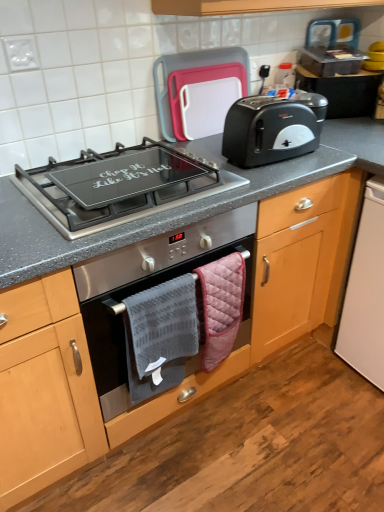
Question: Is gray textured towel at center, which appears as the first hand towel when viewed from the left, positioned far away from plastic cutting board at upper center?

Choices:
 (A) no
 (B) yes

Answer: (A)

Question: From a real-world perspective, is gray textured towel at center, which appears as the first hand towel when viewed from the left, located higher than plastic cutting board at upper center?

Choices:
 (A) no
 (B) yes

Answer: (A)

Question: Can you confirm if gray textured towel at center, which appears as the first hand towel when viewed from the left, is smaller than plastic cutting board at upper center?

Choices:
 (A) yes
 (B) no

Answer: (A)

Question: From the image's perspective, is gray textured towel at center, which is the 2th hand towel from right to left, beneath plastic cutting board at upper center?

Choices:
 (A) yes
 (B) no

Answer: (A)

Question: Is gray textured towel at center, which appears as the first hand towel when viewed from the left, wider than plastic cutting board at upper center?

Choices:
 (A) yes
 (B) no

Answer: (B)

Question: Is black plastic toaster at upper right situated inside pink quilted hand towel at lower center, the 2th hand towel from the left, or outside?

Choices:
 (A) inside
 (B) outside

Answer: (B)

Question: From the image's perspective, is black plastic toaster at upper right positioned above or below pink quilted hand towel at lower center, the 2th hand towel from the left?

Choices:
 (A) below
 (B) above

Answer: (B)

Question: In terms of width, does black plastic toaster at upper right look wider or thinner when compared to pink quilted hand towel at lower center, the 2th hand towel from the left?

Choices:
 (A) wide
 (B) thin

Answer: (A)

Question: From a real-world perspective, relative to pink quilted hand towel at lower center, the 1th hand towel viewed from the right, is black plastic toaster at upper right vertically above or below?

Choices:
 (A) above
 (B) below

Answer: (A)

Question: From the image's perspective, relative to stainless steel oven at center, is black plastic toaster at upper right above or below?

Choices:
 (A) above
 (B) below

Answer: (A)

Question: In terms of width, does black plastic toaster at upper right look wider or thinner when compared to stainless steel oven at center?

Choices:
 (A) thin
 (B) wide

Answer: (A)

Question: Is black plastic toaster at upper right to the left or to the right of stainless steel oven at center in the image?

Choices:
 (A) left
 (B) right

Answer: (B)

Question: Relative to stainless steel oven at center, is black plastic toaster at upper right in front or behind?

Choices:
 (A) behind
 (B) front

Answer: (A)

Question: Based on their sizes in the image, would you say white plastic dishwasher at lower right, which is counted as the 2th appliance, starting from the top, is bigger or smaller than pink quilted hand towel at lower center, the 2th hand towel from the left?

Choices:
 (A) big
 (B) small

Answer: (A)

Question: From a real-world perspective, relative to pink quilted hand towel at lower center, the 2th hand towel from the left, is white plastic dishwasher at lower right, which is counted as the 2th appliance, starting from the top, vertically above or below?

Choices:
 (A) below
 (B) above

Answer: (A)